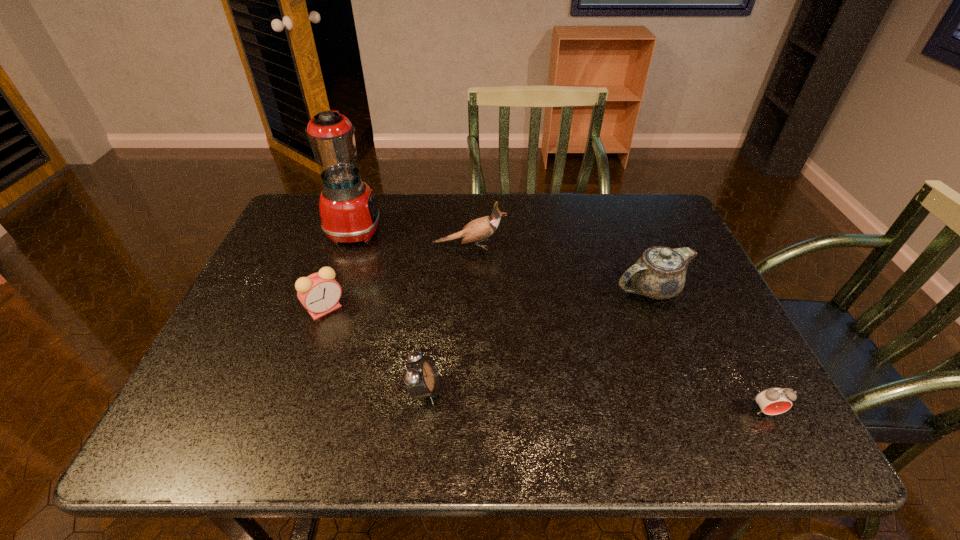
Identify the location of object positioned at the far left corner. The height and width of the screenshot is (540, 960). (349, 214).

This screenshot has height=540, width=960. Identify the location of object that is at the near right corner. (772, 401).

Where is `free space at the far edge of the desktop`? The image size is (960, 540). free space at the far edge of the desktop is located at coordinates (503, 202).

At what (x,y) coordinates should I click in order to perform the action: click on free region at the near edge of the desktop. Please return your answer as a coordinate pair (x, y). This screenshot has width=960, height=540. Looking at the image, I should click on (672, 441).

This screenshot has height=540, width=960. In order to click on vacant space at the left edge of the desktop in this screenshot , I will do `click(248, 291)`.

Find the location of a particular element. The image size is (960, 540). blank space at the right edge is located at coordinates (694, 406).

The width and height of the screenshot is (960, 540). In the image, there is a desktop. In order to click on blank space at the far right corner in this screenshot , I will do `click(673, 221)`.

Find the location of `free area in between the second alarm clock from left to right and the rightmost alarm clock`. free area in between the second alarm clock from left to right and the rightmost alarm clock is located at coordinates (595, 401).

You are a GUI agent. You are given a task and a screenshot of the screen. Output one action in this format:
    pyautogui.click(x=<x>, y=<y>)
    Task: Click on the vacant region between the tallest object and the second alarm clock from left to right
    
    Given the screenshot: What is the action you would take?
    pyautogui.click(x=390, y=310)

Locate an element on the screen. This screenshot has width=960, height=540. free point between the farthest alarm clock and the fifth object from left to right is located at coordinates (489, 299).